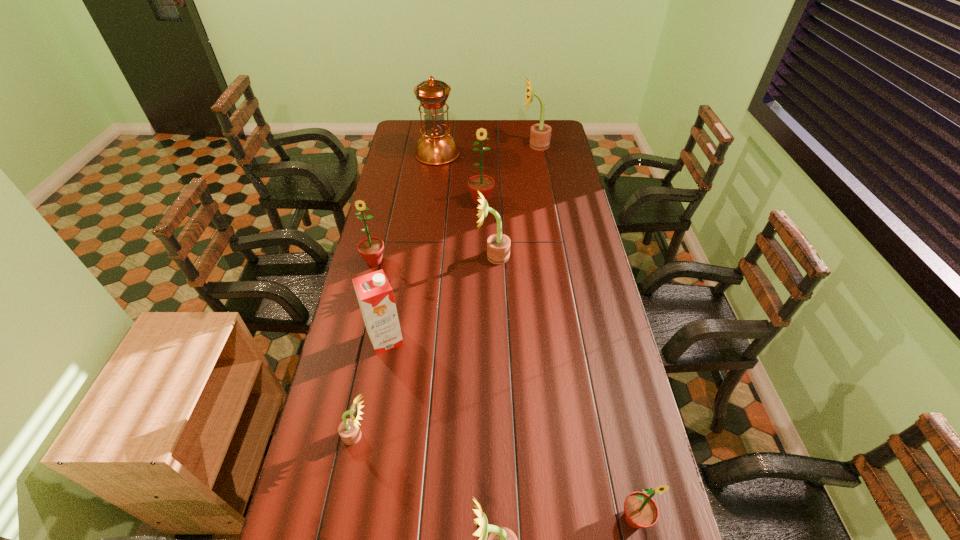
This screenshot has height=540, width=960. Identify the location of free spot between the second biggest yellow sunflower and the shortest sunflower. (424, 346).

Identify the location of object that stands as the sixth closest to the carton. (641, 511).

Image resolution: width=960 pixels, height=540 pixels. In order to click on object that can be found as the third closest to the carton in this screenshot , I will do `click(498, 245)`.

Choose which sunflower is the fourth nearest neighbor to the oil lamp. Please provide its 2D coordinates. Your answer should be formatted as a tuple, i.e. [(x, y)], where the tuple contains the x and y coordinates of a point satisfying the conditions above.

[(371, 249)]

I want to click on sunflower that is the closest to the shortest sunflower, so click(501, 539).

Select which yellow sunflower is the third closest to the rightmost yellow sunflower. Please provide its 2D coordinates. Your answer should be formatted as a tuple, i.e. [(x, y)], where the tuple contains the x and y coordinates of a point satisfying the conditions above.

[(501, 539)]

Choose which yellow sunflower is the nearest neighbor to the fifth farthest sunflower. Please provide its 2D coordinates. Your answer should be formatted as a tuple, i.e. [(x, y)], where the tuple contains the x and y coordinates of a point satisfying the conditions above.

[(501, 539)]

Identify which green sunflower is the second closest to the rightmost green sunflower. Please provide its 2D coordinates. Your answer should be formatted as a tuple, i.e. [(x, y)], where the tuple contains the x and y coordinates of a point satisfying the conditions above.

[(483, 183)]

Locate an element on the screen. The height and width of the screenshot is (540, 960). green sunflower that is the closest one to the second smallest green sunflower is located at coordinates (483, 183).

Locate an element on the screen. This screenshot has width=960, height=540. free spot that satisfies the following two spatial constraints: 1. on the face of the farthest sunflower; 2. on the face of the sixth nearest sunflower is located at coordinates (544, 201).